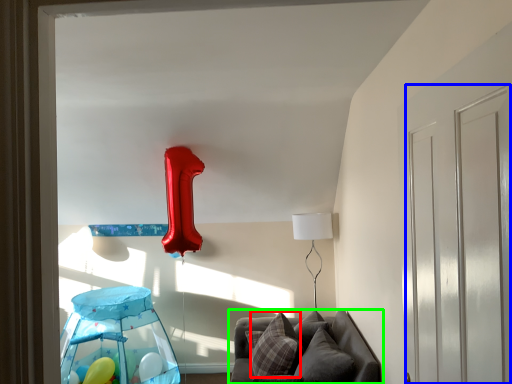
Question: Based on their relative distances, which object is farther from pillow (highlighted by a red box)? Choose from glass door (highlighted by a blue box) and furniture (highlighted by a green box).

Choices:
 (A) glass door
 (B) furniture

Answer: (A)